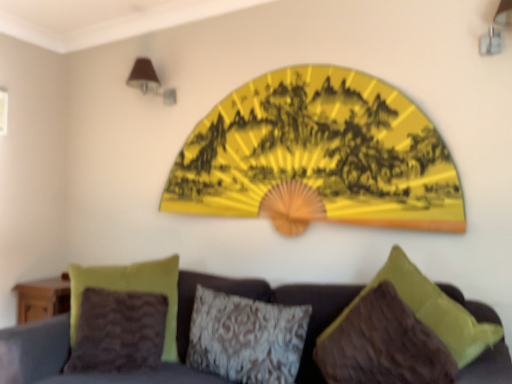
The height and width of the screenshot is (384, 512). I want to click on brown fabric lampshade at upper left, so click(x=149, y=81).

You are a GUI agent. You are given a task and a screenshot of the screen. Output one action in this format:
    pyautogui.click(x=<x>, y=<y>)
    Task: Click on the velvet brown pillow at lower left, the 3th pillow from the right
    Image resolution: width=512 pixels, height=384 pixels.
    Given the screenshot: What is the action you would take?
    point(131,291)

The height and width of the screenshot is (384, 512). Describe the element at coordinates (67, 358) in the screenshot. I see `velvet fabric couch at center` at that location.

At what (x,y) coordinates should I click in order to perform the action: click on textured gray pillow at center, the second pillow viewed from the left. Please return your answer as a coordinate pair (x, y). Looking at the image, I should click on (246, 338).

Is textured gray pillow at center, the second pillow viewed from the left, not close to yellow paper fan at upper center?

No, textured gray pillow at center, the second pillow viewed from the left, is not far away from yellow paper fan at upper center.

Can you confirm if textured gray pillow at center, the second pillow when ordered from right to left, is shorter than yellow paper fan at upper center?

Yes, textured gray pillow at center, the second pillow when ordered from right to left, is shorter than yellow paper fan at upper center.

Does textured gray pillow at center, the second pillow when ordered from right to left, have a smaller size compared to yellow paper fan at upper center?

Indeed, textured gray pillow at center, the second pillow when ordered from right to left, has a smaller size compared to yellow paper fan at upper center.

Which object is positioned more to the left, yellow paper fan at upper center or velvet brown pillow at lower left, the 3th pillow from the right?

Positioned to the left is velvet brown pillow at lower left, the 3th pillow from the right.

From the image's perspective, is yellow paper fan at upper center above or below velvet brown pillow at lower left, the 3th pillow from the right?

From the image's perspective, yellow paper fan at upper center appears above velvet brown pillow at lower left, the 3th pillow from the right.

Considering the points (400, 132) and (162, 284), which point is in front, point (400, 132) or point (162, 284)?

The point (400, 132) is closer to the camera.

Which object is wider, yellow paper fan at upper center or velvet brown pillow at lower left, the 3th pillow from the right?

With larger width is velvet brown pillow at lower left, the 3th pillow from the right.

At what (x,y) coordinates should I click in order to perform the action: click on lamp that is above the brown fuzzy pillow at lower right, marked as the 1th pillow in a right-to-left arrangement (from a real-world perspective). Please return your answer as a coordinate pair (x, y). Looking at the image, I should click on (149, 81).

Between brown fabric lampshade at upper left and brown fuzzy pillow at lower right, marked as the 1th pillow in a right-to-left arrangement, which one is positioned behind?

brown fabric lampshade at upper left is more distant.

From a real-world perspective, is brown fabric lampshade at upper left under brown fuzzy pillow at lower right, marked as the 1th pillow in a right-to-left arrangement?

Actually, brown fabric lampshade at upper left is physically above brown fuzzy pillow at lower right, marked as the 1th pillow in a right-to-left arrangement, in the real world.

Is velvet brown pillow at lower left, the 3th pillow from the right, to the left or to the right of brown fuzzy pillow at lower right, which ranks as the 3th pillow in left-to-right order, in the image?

Clearly, velvet brown pillow at lower left, the 3th pillow from the right, is on the left of brown fuzzy pillow at lower right, which ranks as the 3th pillow in left-to-right order, in the image.

Relative to brown fuzzy pillow at lower right, marked as the 1th pillow in a right-to-left arrangement, is velvet brown pillow at lower left, the 3th pillow from the right, in front or behind?

velvet brown pillow at lower left, the 3th pillow from the right, is behind brown fuzzy pillow at lower right, marked as the 1th pillow in a right-to-left arrangement.

Considering the relative sizes of velvet brown pillow at lower left, the 3th pillow from the right, and brown fuzzy pillow at lower right, marked as the 1th pillow in a right-to-left arrangement, in the image provided, is velvet brown pillow at lower left, the 3th pillow from the right, thinner than brown fuzzy pillow at lower right, marked as the 1th pillow in a right-to-left arrangement,?

Yes.

Find the location of `pillow above the velvet brown pillow at lower left, which is the 1th pillow from left to right (from the image's perspective)`. pillow above the velvet brown pillow at lower left, which is the 1th pillow from left to right (from the image's perspective) is located at coordinates (384, 345).

From the picture: Considering the relative positions of brown fabric lampshade at upper left and velvet brown pillow at lower left, the 3th pillow from the right, in the image provided, is brown fabric lampshade at upper left to the left or to the right of velvet brown pillow at lower left, the 3th pillow from the right,?

From the image, it's evident that brown fabric lampshade at upper left is to the left of velvet brown pillow at lower left, the 3th pillow from the right.

Is brown fabric lampshade at upper left beside velvet brown pillow at lower left, the 3th pillow from the right?

No, brown fabric lampshade at upper left is not with velvet brown pillow at lower left, the 3th pillow from the right.

From the image's perspective, is brown fabric lampshade at upper left positioned above or below velvet brown pillow at lower left, which is the 1th pillow from left to right?

brown fabric lampshade at upper left is above velvet brown pillow at lower left, which is the 1th pillow from left to right.

How distant is brown fabric lampshade at upper left from velvet brown pillow at lower left, the 3th pillow from the right?

brown fabric lampshade at upper left and velvet brown pillow at lower left, the 3th pillow from the right, are 3.70 feet apart from each other.

Is yellow paper fan at upper center not within velvet fabric couch at center?

Yes, yellow paper fan at upper center is located beyond the bounds of velvet fabric couch at center.

Is yellow paper fan at upper center at the left side of velvet fabric couch at center?

No.

From the image's perspective, would you say yellow paper fan at upper center is positioned over velvet fabric couch at center?

Yes, from the image's perspective, yellow paper fan at upper center is over velvet fabric couch at center.

From the picture: From a real-world perspective, between yellow paper fan at upper center and velvet fabric couch at center, who is vertically higher?

yellow paper fan at upper center is physically above.

Is brown fuzzy pillow at lower right, marked as the 1th pillow in a right-to-left arrangement, oriented towards velvet fabric couch at center?

Yes, brown fuzzy pillow at lower right, marked as the 1th pillow in a right-to-left arrangement, is aimed at velvet fabric couch at center.

Looking at this image, which point is more forward, (426, 333) or (440, 285)?

Point (426, 333)

Considering the positions of objects brown fuzzy pillow at lower right, which ranks as the 3th pillow in left-to-right order, and velvet fabric couch at center in the image provided, who is more to the left, brown fuzzy pillow at lower right, which ranks as the 3th pillow in left-to-right order, or velvet fabric couch at center?

Positioned to the left is velvet fabric couch at center.

Is brown fuzzy pillow at lower right, marked as the 1th pillow in a right-to-left arrangement, touching velvet fabric couch at center?

brown fuzzy pillow at lower right, marked as the 1th pillow in a right-to-left arrangement, and velvet fabric couch at center are not in contact.

In order to click on the 3rd pillow below the yellow paper fan at upper center (from a real-world perspective) in this screenshot , I will do `click(246, 338)`.

Where is `design located above the velvet brown pillow at lower left, the 3th pillow from the right (from a real-world perspective)`? design located above the velvet brown pillow at lower left, the 3th pillow from the right (from a real-world perspective) is located at coordinates (318, 156).

Which object lies further to the anchor point brown fabric lampshade at upper left, velvet brown pillow at lower left, which is the 1th pillow from left to right, or textured gray pillow at center, the second pillow when ordered from right to left?

Among the two, textured gray pillow at center, the second pillow when ordered from right to left, is located further to brown fabric lampshade at upper left.

Which object lies further to the anchor point velvet brown pillow at lower left, the 3th pillow from the right, yellow paper fan at upper center or textured gray pillow at center, the second pillow viewed from the left?

yellow paper fan at upper center is further to velvet brown pillow at lower left, the 3th pillow from the right.

Based on their spatial positions, is velvet fabric couch at center or velvet brown pillow at lower left, the 3th pillow from the right, closer to brown fuzzy pillow at lower right, which ranks as the 3th pillow in left-to-right order?

velvet fabric couch at center is positioned closer to the anchor brown fuzzy pillow at lower right, which ranks as the 3th pillow in left-to-right order.

Which object lies further to the anchor point brown fabric lampshade at upper left, textured gray pillow at center, the second pillow when ordered from right to left, or brown fuzzy pillow at lower right, which ranks as the 3th pillow in left-to-right order?

Among the two, brown fuzzy pillow at lower right, which ranks as the 3th pillow in left-to-right order, is located further to brown fabric lampshade at upper left.

Which object lies further to the anchor point brown fuzzy pillow at lower right, marked as the 1th pillow in a right-to-left arrangement, textured gray pillow at center, the second pillow viewed from the left, or brown fabric lampshade at upper left?

Based on the image, brown fabric lampshade at upper left appears to be further to brown fuzzy pillow at lower right, marked as the 1th pillow in a right-to-left arrangement.

Considering their positions, is velvet fabric couch at center positioned further to textured gray pillow at center, the second pillow viewed from the left, than yellow paper fan at upper center?

Among the two, yellow paper fan at upper center is located further to textured gray pillow at center, the second pillow viewed from the left.

Consider the image. Looking at the image, which one is located further to yellow paper fan at upper center, textured gray pillow at center, the second pillow when ordered from right to left, or brown fuzzy pillow at lower right, marked as the 1th pillow in a right-to-left arrangement?

The object further to yellow paper fan at upper center is brown fuzzy pillow at lower right, marked as the 1th pillow in a right-to-left arrangement.

Estimate the real-world distances between objects in this image. Which object is further from textured gray pillow at center, the second pillow viewed from the left, velvet brown pillow at lower left, which is the 1th pillow from left to right, or brown fabric lampshade at upper left?

brown fabric lampshade at upper left.

In order to click on studio couch between velvet brown pillow at lower left, the 3th pillow from the right, and brown fuzzy pillow at lower right, marked as the 1th pillow in a right-to-left arrangement, from left to right in this screenshot , I will do `click(67, 358)`.

The width and height of the screenshot is (512, 384). In order to click on pillow located between velvet brown pillow at lower left, which is the 1th pillow from left to right, and brown fuzzy pillow at lower right, marked as the 1th pillow in a right-to-left arrangement, in the left-right direction in this screenshot , I will do `click(246, 338)`.

The width and height of the screenshot is (512, 384). Identify the location of design that lies between brown fabric lampshade at upper left and velvet brown pillow at lower left, which is the 1th pillow from left to right, from top to bottom. (318, 156).

Locate an element on the screen. design between velvet brown pillow at lower left, the 3th pillow from the right, and brown fuzzy pillow at lower right, which ranks as the 3th pillow in left-to-right order is located at coordinates (318, 156).